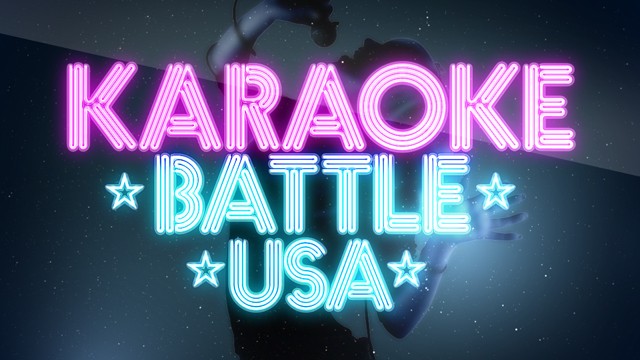
Where is `light gray color on wall`? The width and height of the screenshot is (640, 360). light gray color on wall is located at coordinates (152, 30).